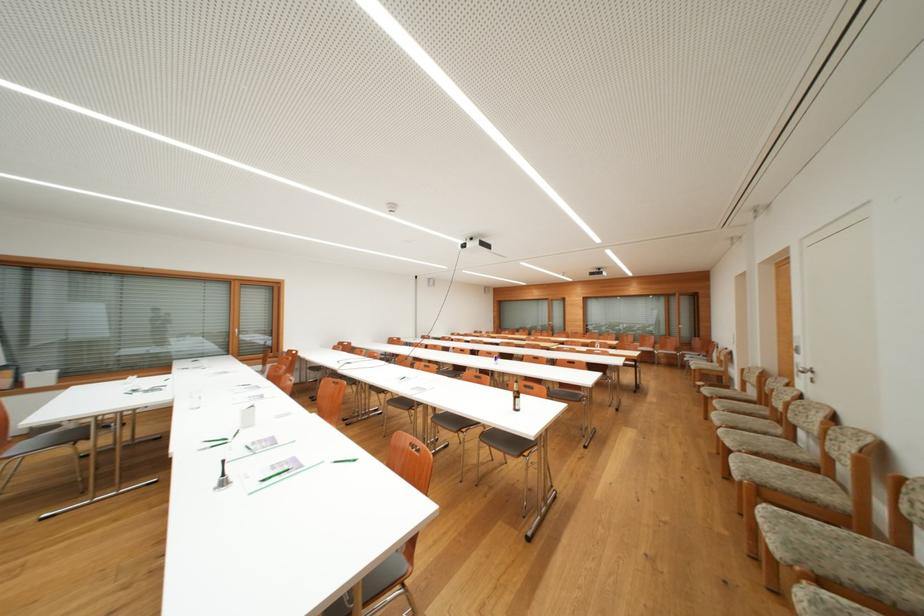
Locate an element on the screen. This screenshot has width=924, height=616. window handle is located at coordinates (235, 331).